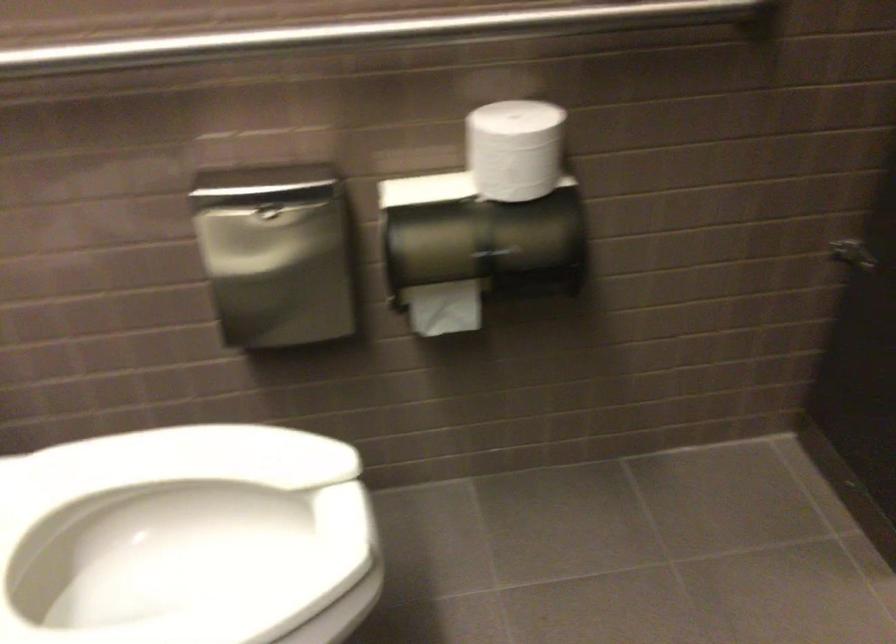
Find where to lower the white toilet seat. Please return your answer as a coordinate pair (x, y).

(186, 538)